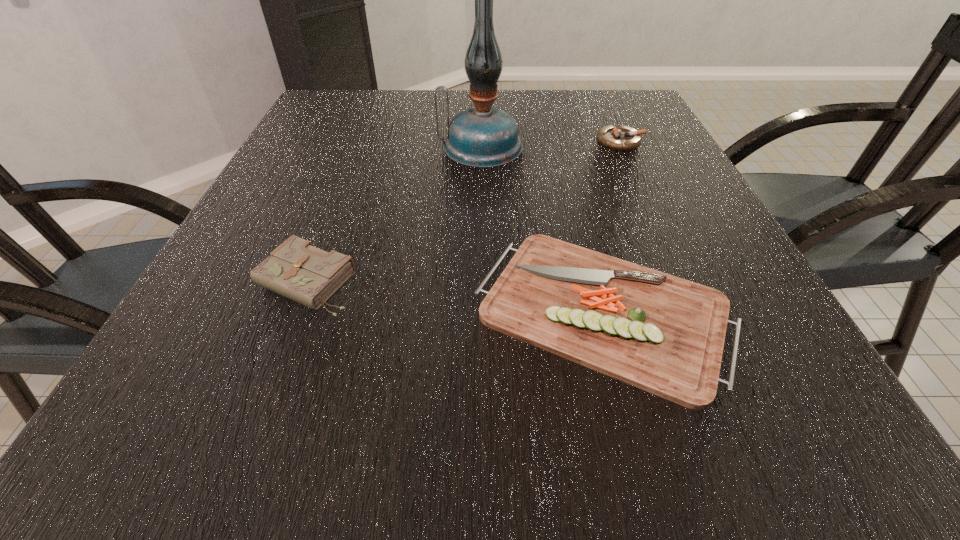
Where is `the tallest object`? the tallest object is located at coordinates (482, 137).

Locate an element on the screen. This screenshot has height=540, width=960. the second tallest object is located at coordinates (296, 269).

Where is `diary`? The height and width of the screenshot is (540, 960). diary is located at coordinates (296, 269).

Identify the location of ashtray. (620, 138).

Where is `chopping board`? This screenshot has height=540, width=960. chopping board is located at coordinates (663, 334).

Find the location of a particular element. Image resolution: width=960 pixels, height=540 pixels. vacant space located on the left of the oil lamp is located at coordinates (355, 147).

Image resolution: width=960 pixels, height=540 pixels. Find the location of `free space located on the back of the leftmost object`. free space located on the back of the leftmost object is located at coordinates (348, 172).

Where is `free space located 0.170m on the left of the ashtray`? This screenshot has width=960, height=540. free space located 0.170m on the left of the ashtray is located at coordinates (527, 141).

The image size is (960, 540). Find the location of `vacant space located 0.370m on the back of the chopping board`. vacant space located 0.370m on the back of the chopping board is located at coordinates (560, 141).

Image resolution: width=960 pixels, height=540 pixels. Identify the location of object at the near edge. tap(663, 334).